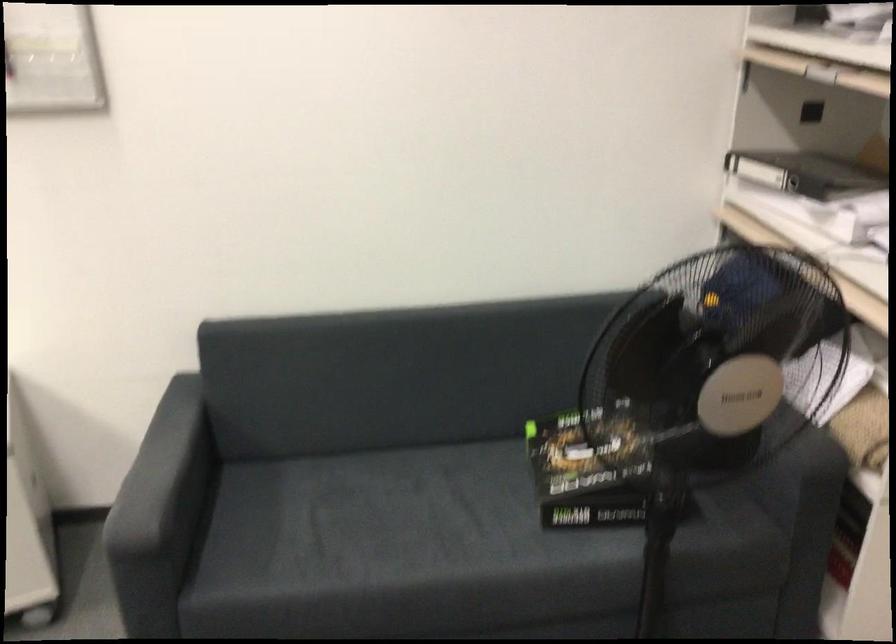
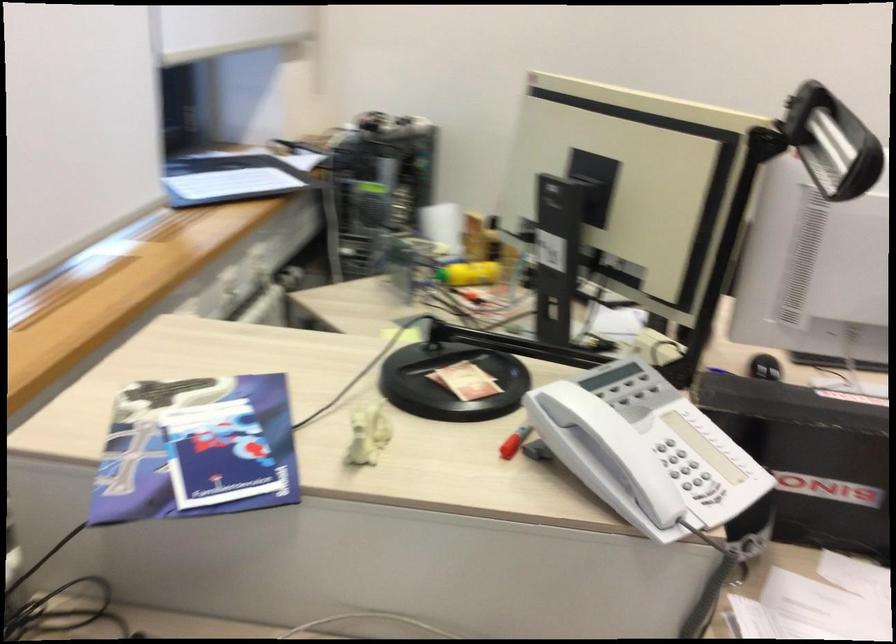
The images are taken continuously from a first-person perspective. In which direction are you moving?

The cameraman walked toward left, backward.